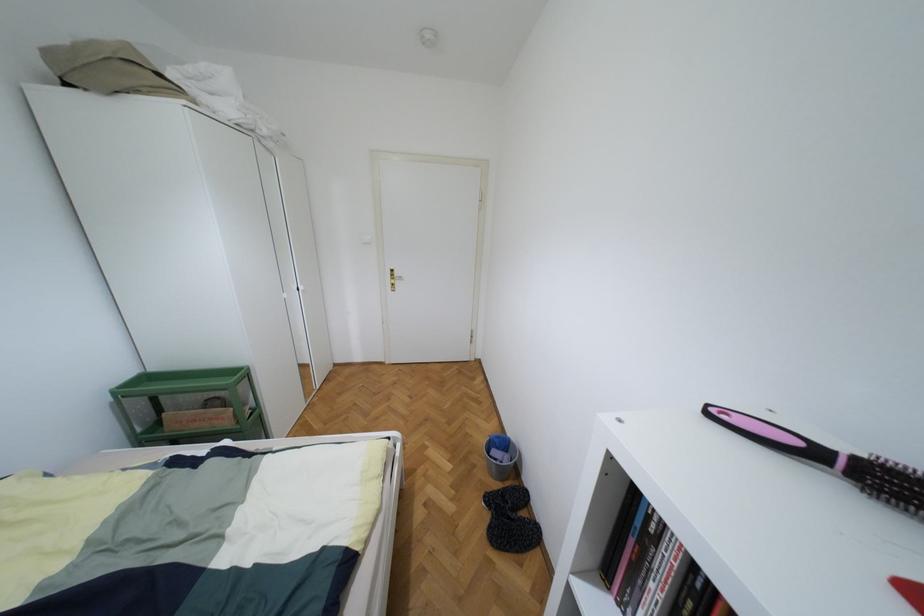
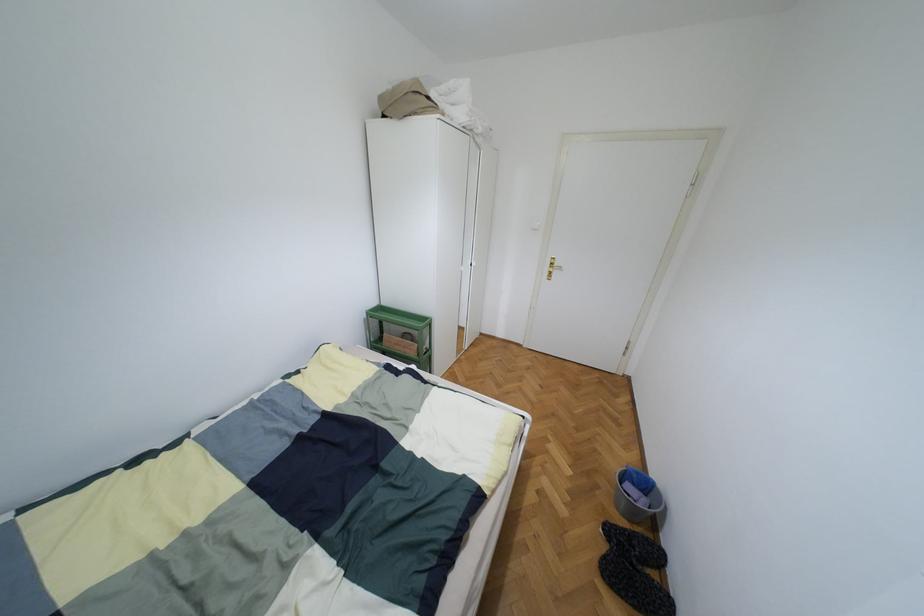
Find the pixel in the second image that matches pixel 492 545 in the first image.

(602, 577)